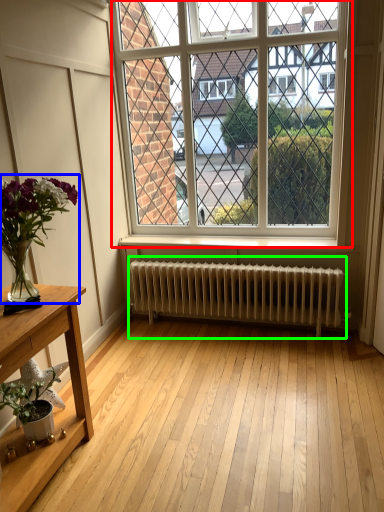
Question: Which object is the closest to the window (highlighted by a red box)? Choose among these: houseplant (highlighted by a blue box) or radiator (highlighted by a green box).

Choices:
 (A) houseplant
 (B) radiator

Answer: (B)